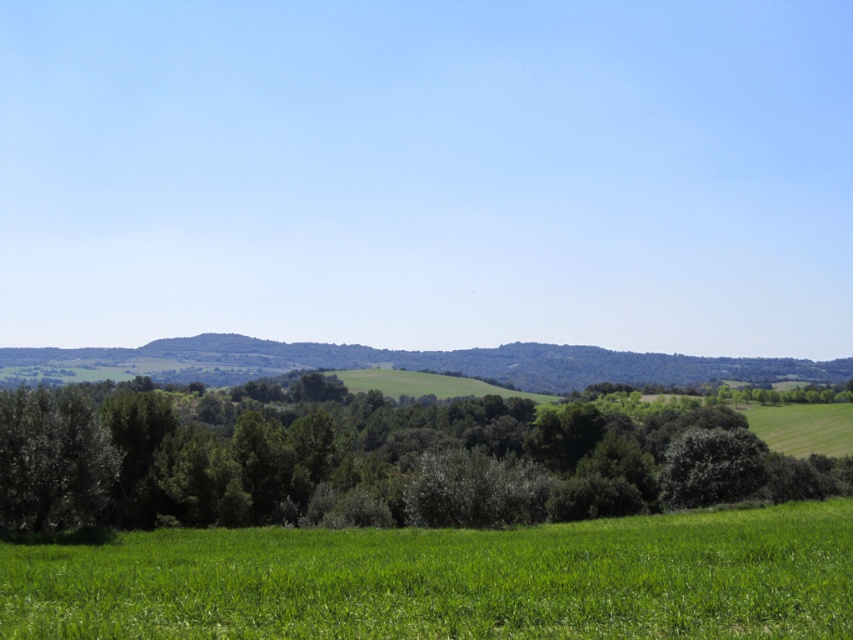
Question: Which of the following is the farthest from the observer?

Choices:
 (A) 392,480
 (B) 334,618

Answer: (A)

Question: Can you confirm if green leafy trees at center is wider than green grassy field at lower left?

Choices:
 (A) yes
 (B) no

Answer: (A)

Question: Is the position of green leafy trees at center less distant than that of green grassy field at lower left?

Choices:
 (A) yes
 (B) no

Answer: (B)

Question: Can you confirm if green leafy trees at center is thinner than green grassy field at lower left?

Choices:
 (A) no
 (B) yes

Answer: (A)